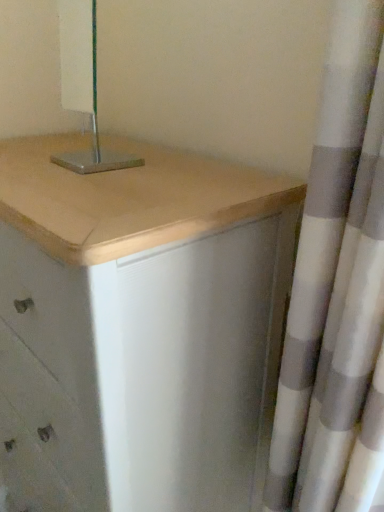
Locate an element on the screen. vacant space situated above matte white chest of drawers at center (from a real-world perspective) is located at coordinates (101, 159).